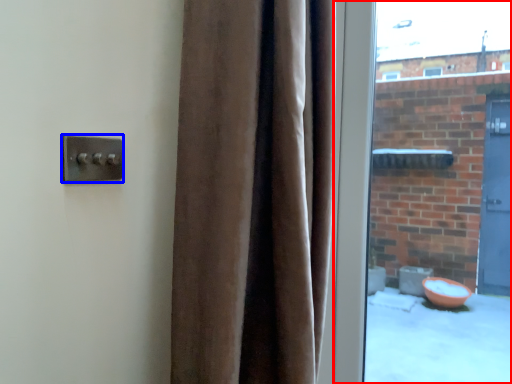
Question: Which object is closer to the camera taking this photo, window (highlighted by a red box) or door handle (highlighted by a blue box)?

Choices:
 (A) window
 (B) door handle

Answer: (B)